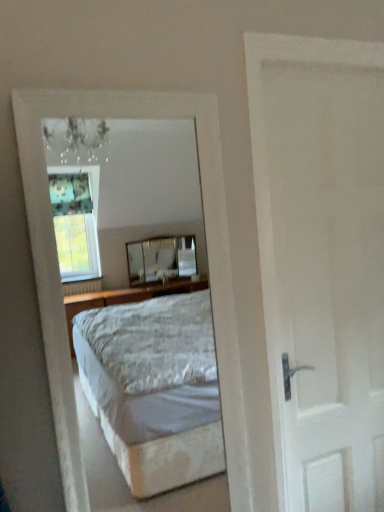
This screenshot has height=512, width=384. Find the location of `white matte door at right`. white matte door at right is located at coordinates (329, 278).

In the scene shown: What is the approximate height of white matte door at right?

1.60 meters.

The height and width of the screenshot is (512, 384). What do you see at coordinates (329, 278) in the screenshot?
I see `white matte door at right` at bounding box center [329, 278].

At what (x,y) coordinates should I click in order to perform the action: click on white matte door at right. Please return your answer as a coordinate pair (x, y). The image size is (384, 512). Looking at the image, I should click on (329, 278).